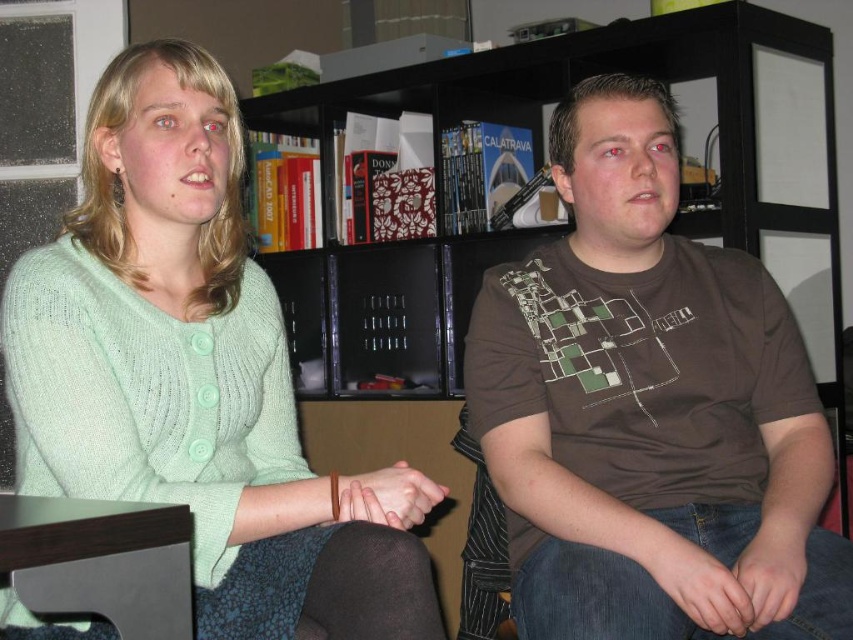
Who is taller, green knitted sweater at upper left or jeans at lower right?

green knitted sweater at upper left

Where is `green knitted sweater at upper left`? This screenshot has height=640, width=853. green knitted sweater at upper left is located at coordinates (196, 376).

Where is `green knitted sweater at upper left`? The height and width of the screenshot is (640, 853). green knitted sweater at upper left is located at coordinates (196, 376).

Is brown cotton t-shirt at center smaller than black matte bookshelf at upper center?

Yes.

Does brown cotton t-shirt at center have a greater height compared to black matte bookshelf at upper center?

No, brown cotton t-shirt at center is not taller than black matte bookshelf at upper center.

Between point (634, 86) and point (543, 52), which one is positioned in front?

Point (634, 86) is more forward.

Identify the location of brown cotton t-shirt at center. This screenshot has width=853, height=640. (650, 410).

Which is below, brown cotton t-shirt at center or green knitted sweater at upper left?

Positioned lower is green knitted sweater at upper left.

Is brown cotton t-shirt at center closer to camera compared to green knitted sweater at upper left?

No, it is not.

Describe the element at coordinates (650, 410) in the screenshot. I see `brown cotton t-shirt at center` at that location.

The height and width of the screenshot is (640, 853). What are the coordinates of `brown cotton t-shirt at center` in the screenshot? It's located at (650, 410).